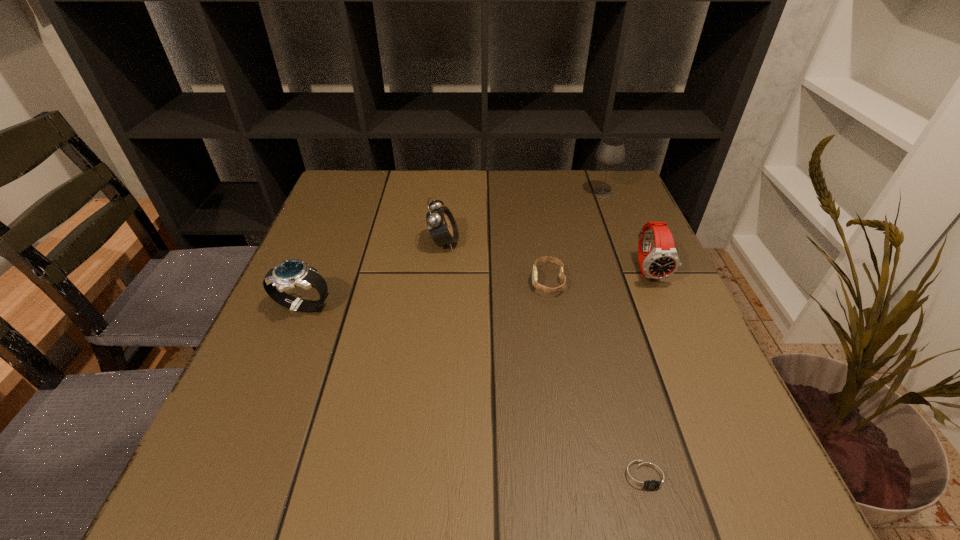
Choose which watch is the nearest neighbor to the third shortest object. Please provide its 2D coordinates. Your answer should be formatted as a tuple, i.e. [(x, y)], where the tuple contains the x and y coordinates of a point satisfying the conditions above.

[(545, 289)]

You are a GUI agent. You are given a task and a screenshot of the screen. Output one action in this format:
    pyautogui.click(x=<x>, y=<y>)
    Task: Click on the closest watch to the tallest object
    
    Given the screenshot: What is the action you would take?
    pos(661,262)

Where is `vacant point that satisfies the following two spatial constraints: 1. on the face of the rightmost watch; 2. on the face of the fifth tallest object`? This screenshot has width=960, height=540. vacant point that satisfies the following two spatial constraints: 1. on the face of the rightmost watch; 2. on the face of the fifth tallest object is located at coordinates (654, 281).

In order to click on free region that satisfies the following two spatial constraints: 1. on the face of the rightmost watch; 2. on the face of the fourth object from right to left in this screenshot , I will do `click(654, 281)`.